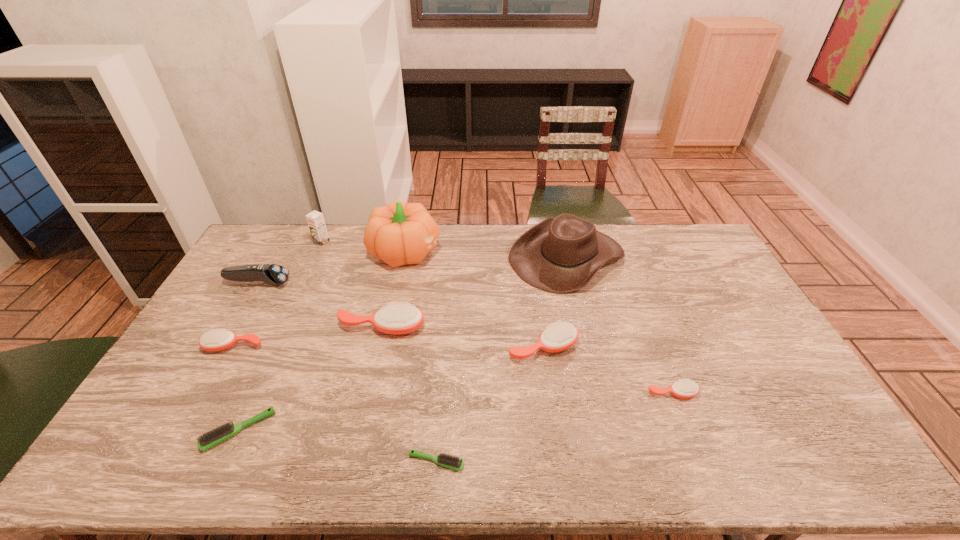
Where is `hairbrush present at the left edge`? The image size is (960, 540). hairbrush present at the left edge is located at coordinates [217, 339].

What are the coordinates of `vacant point at the far edge` in the screenshot? It's located at (620, 230).

Identify the location of vacant region at the near edge of the desktop. (338, 444).

Identify the location of vacant area at the right edge. click(x=783, y=400).

Locate an element on the screen. vacant space at the far left corner is located at coordinates (277, 255).

This screenshot has width=960, height=540. What are the coordinates of `free space between the electric shaver and the tallest object` in the screenshot? It's located at (332, 267).

The image size is (960, 540). I want to click on vacant area that lies between the rightmost orange hairbrush and the electric shaver, so click(x=465, y=338).

In order to click on empty location between the bigger light hairbrush and the third smallest orange hairbrush in this screenshot , I will do pyautogui.click(x=391, y=389).

I want to click on empty location between the shortest object and the pumpkin, so click(x=421, y=356).

You are a GUI agent. You are given a task and a screenshot of the screen. Output one action in this format:
    pyautogui.click(x=<x>, y=<y>)
    Task: Click on the vacant area between the brown chocolate milk and the second biggest orange hairbrush
    
    Given the screenshot: What is the action you would take?
    pyautogui.click(x=432, y=294)